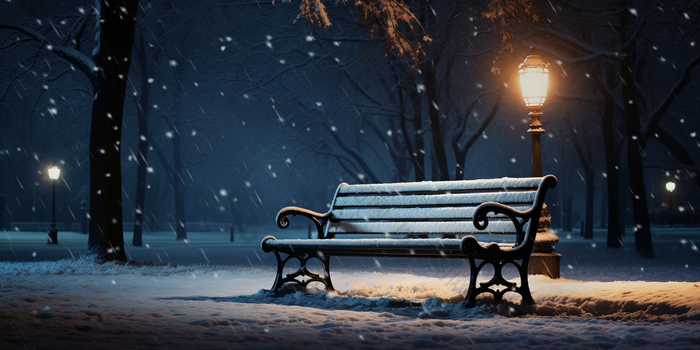
Locate an element on the screen. chair stances is located at coordinates (507, 292).